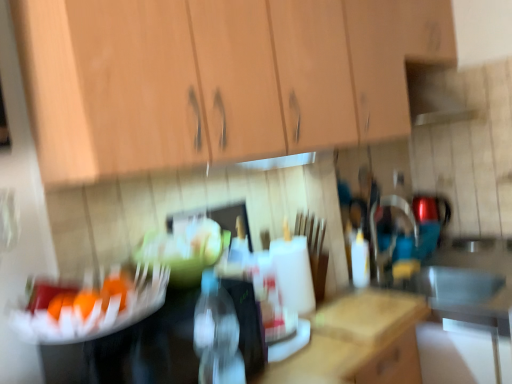
Question: From a real-world perspective, is white plastic bottle at center, arranged as the 2th bottle when viewed from the left, physically located above or below transparent plastic bottle at center, the second bottle positioned from the back?

Choices:
 (A) below
 (B) above

Answer: (A)

Question: From the image's perspective, is white plastic bottle at center, the first bottle when ordered from right to left, above or below transparent plastic bottle at center, positioned as the first bottle in left-to-right order?

Choices:
 (A) below
 (B) above

Answer: (B)

Question: Estimate the real-world distances between objects in this image. Which object is closer to the orange matte fruit at center?

Choices:
 (A) white plastic bottle at center, arranged as the 2th bottle when viewed from the left
 (B) transparent plastic bottle at center, which is the 1th bottle in front-to-back order
 (C) wooden cabinet at upper center

Answer: (B)

Question: Estimate the real-world distances between objects in this image. Which object is closer to the white plastic bottle at center, arranged as the 2th bottle when viewed from the left?

Choices:
 (A) transparent plastic bottle at center, which is the 1th bottle in front-to-back order
 (B) orange matte fruit at center
 (C) wooden cabinet at upper center

Answer: (C)